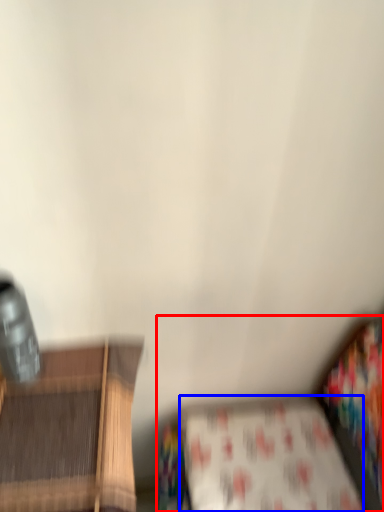
Question: Which object appears closest to the camera in this image, studio couch (highlighted by a red box) or sheet (highlighted by a blue box)?

Choices:
 (A) studio couch
 (B) sheet

Answer: (A)